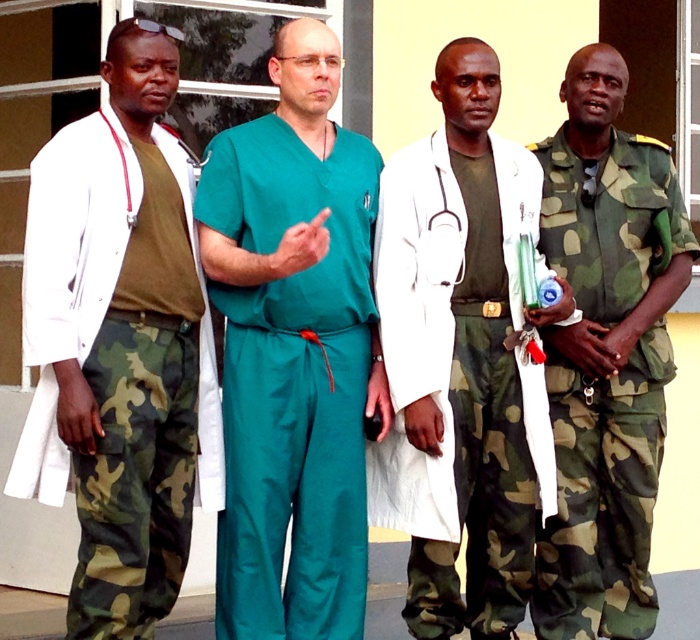
You are a security guard observing the scene. There are two people wearing camouflage fabric clothing. The first has camo fabric pants at left, and the second has camo fabric uniform at right. Which one is positioned more to the left side?

The camo fabric pants at left is more on the left side than the camo fabric uniform at right.

What is the 2D coordinate of the white matte coat at center?

The white matte coat at center is located at the 2D coordinate point of (462, 378).

You are an observer standing in front of the building. You see the white matte coat at center and the camo fabric pants at left. Which object takes up more space in the image?

The camo fabric pants at left take up more space in the image because the white matte coat at center occupies less space than camo fabric pants at left according to the description.